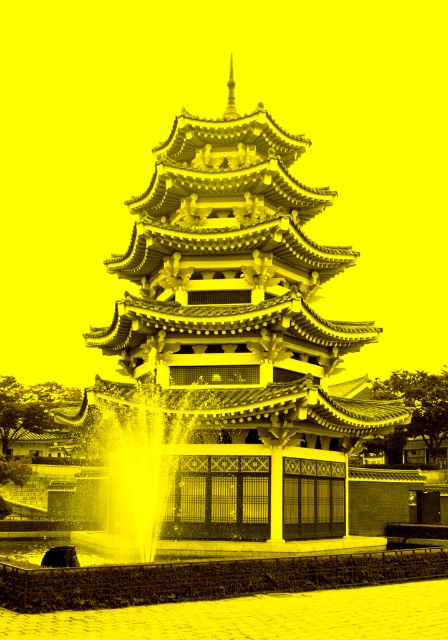
You are standing in front of a traditional East Asian pagoda with a fountain nearby. There is a specific point marked at coordinates (x=231, y=346). Which object does this point correspond to?

The point corresponds to the yellowish white stone pagoda at center.